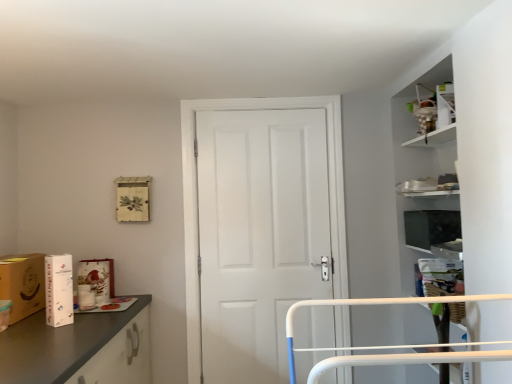
Question: Can you confirm if white cardboard box at left is shorter than white matte cardboard box at left, which ranks as the second cardboard box in left-to-right order?

Choices:
 (A) yes
 (B) no

Answer: (A)

Question: Does white cardboard box at left touch white matte cardboard box at left, which ranks as the second cardboard box in left-to-right order?

Choices:
 (A) yes
 (B) no

Answer: (B)

Question: From the image's perspective, is white cardboard box at left located above white matte cardboard box at left, the first cardboard box positioned from the right?

Choices:
 (A) no
 (B) yes

Answer: (A)

Question: Is white cardboard box at left taller than white matte cardboard box at left, the first cardboard box positioned from the right?

Choices:
 (A) yes
 (B) no

Answer: (B)

Question: Would you say white cardboard box at left is outside white matte cardboard box at left, the first cardboard box positioned from the right?

Choices:
 (A) no
 (B) yes

Answer: (B)

Question: From a real-world perspective, is white cardboard box at left located beneath white matte cardboard box at left, the first cardboard box positioned from the right?

Choices:
 (A) yes
 (B) no

Answer: (A)

Question: From a real-world perspective, is white cardboard box at left under matte brown cardboard box at left, arranged as the second cardboard box when viewed from the right?

Choices:
 (A) no
 (B) yes

Answer: (B)

Question: From a real-world perspective, is white cardboard box at left over matte brown cardboard box at left, arranged as the second cardboard box when viewed from the right?

Choices:
 (A) no
 (B) yes

Answer: (A)

Question: Is white cardboard box at left closer to the viewer compared to matte brown cardboard box at left, which is the first cardboard box from left to right?

Choices:
 (A) no
 (B) yes

Answer: (A)

Question: Is white cardboard box at left taller than matte brown cardboard box at left, arranged as the second cardboard box when viewed from the right?

Choices:
 (A) yes
 (B) no

Answer: (B)

Question: Can you confirm if white cardboard box at left is smaller than matte brown cardboard box at left, arranged as the second cardboard box when viewed from the right?

Choices:
 (A) no
 (B) yes

Answer: (B)

Question: Is white cardboard box at left at the right side of matte brown cardboard box at left, which is the first cardboard box from left to right?

Choices:
 (A) yes
 (B) no

Answer: (A)

Question: Can you confirm if white matte cardboard box at left, the first cardboard box positioned from the right, is bigger than white cardboard box at left?

Choices:
 (A) no
 (B) yes

Answer: (A)